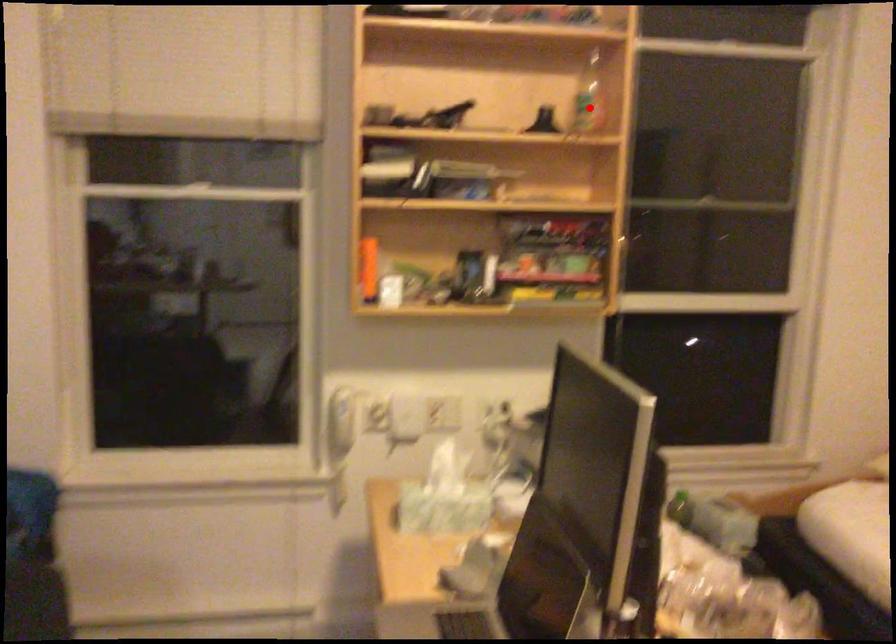
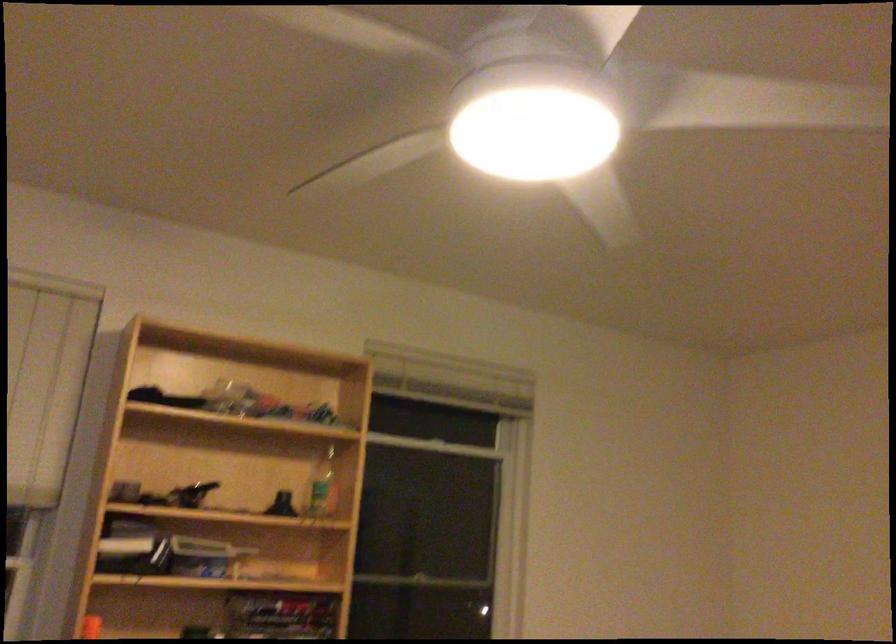
The point at the highlighted location is marked in the first image. Where is the corresponding point in the second image?

(323, 486)